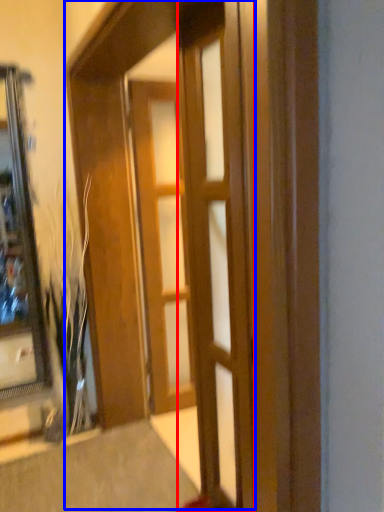
Question: Which of the following is the closest to the observer, door (highlighted by a red box) or barn door (highlighted by a blue box)?

Choices:
 (A) door
 (B) barn door

Answer: (B)